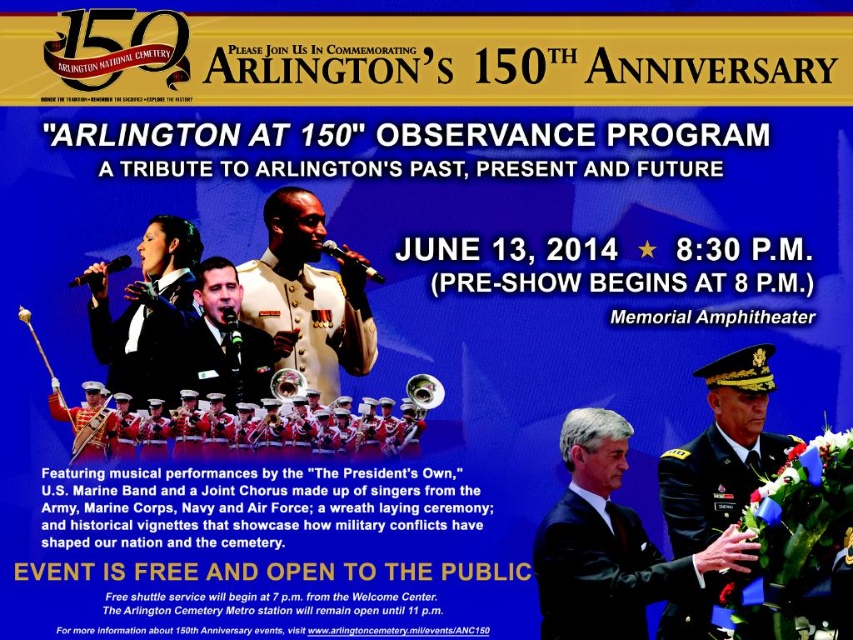
Question: Does shiny black uniform at center have a smaller size compared to brass/polished metal tuba at center?

Choices:
 (A) yes
 (B) no

Answer: (B)

Question: Which point is farther to the camera?

Choices:
 (A) black uniform at center
 (B) black plastic microphone at upper left
 (C) metallic microphone at center
 (D) shiny gold trumpet at center

Answer: (C)

Question: Is shiny black uniform at center positioned in front of shiny gold trumpet at center?

Choices:
 (A) no
 (B) yes

Answer: (A)

Question: Considering the relative positions of black uniform at center and dark green fabric military uniform at lower right in the image provided, where is black uniform at center located with respect to dark green fabric military uniform at lower right?

Choices:
 (A) right
 (B) left

Answer: (B)

Question: Which point is closer to the camera taking this photo?

Choices:
 (A) (650, 560)
 (B) (239, 364)

Answer: (A)

Question: Which object appears closest to the camera in this image?

Choices:
 (A) shiny black uniform at center
 (B) shiny black suit at left

Answer: (A)